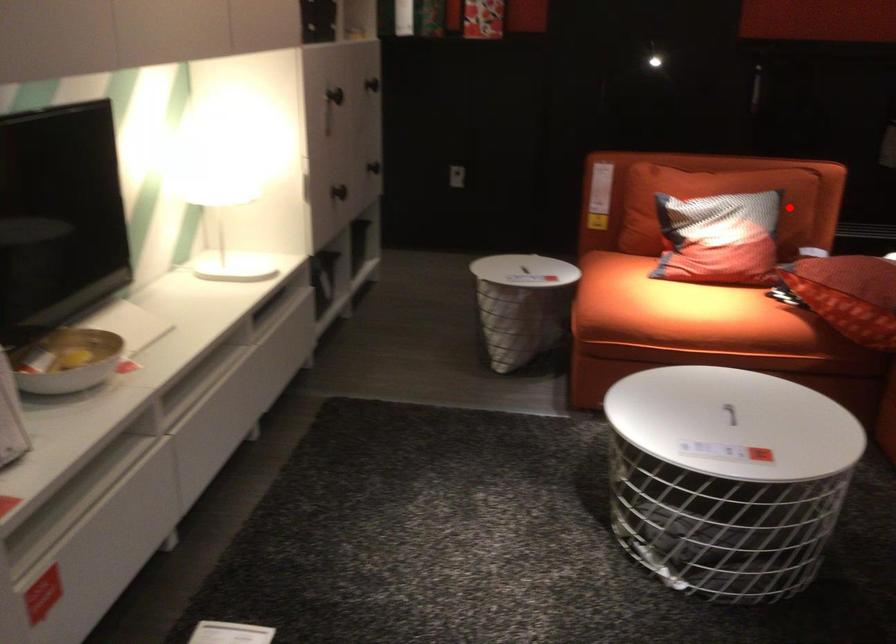
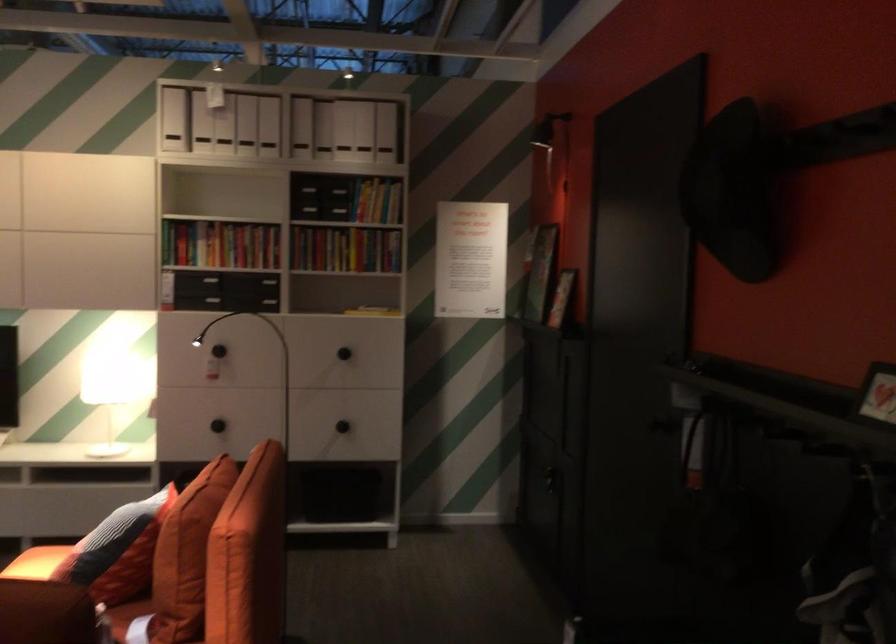
The point at the highlighted location is marked in the first image. Where is the corresponding point in the second image?

(117, 551)